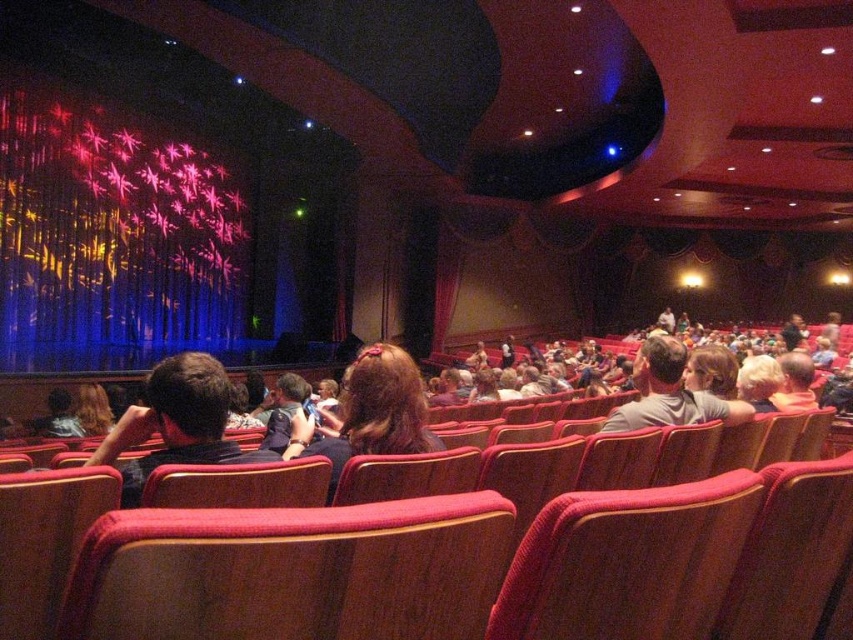
Question: Which point is farther to the camera?

Choices:
 (A) velvet red seat at center
 (B) matte gray shirt at center
 (C) shiny blue fabric at upper left
 (D) matte black hair at center

Answer: (C)

Question: Does velvet red seat at center appear on the left side of matte gray shirt at center?

Choices:
 (A) yes
 (B) no

Answer: (A)

Question: Which point is closer to the camera?

Choices:
 (A) (410, 429)
 (B) (294, 618)
 (C) (664, 422)

Answer: (B)

Question: Which is nearer to the wooden seat at center?

Choices:
 (A) velvet red seat at center
 (B) matte black hair at center
 (C) shiny blue fabric at upper left

Answer: (A)

Question: Is velvet red seat at center bigger than matte gray shirt at center?

Choices:
 (A) yes
 (B) no

Answer: (B)

Question: Is velvet red seat at center above matte black hair at center?

Choices:
 (A) no
 (B) yes

Answer: (A)